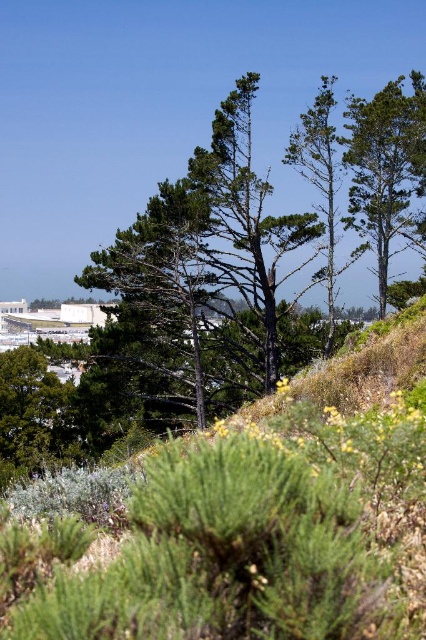
Question: Can you confirm if green matte tree at upper right is smaller than green matte tree at center?

Choices:
 (A) no
 (B) yes

Answer: (A)

Question: Among these objects, which one is nearest to the camera?

Choices:
 (A) green matte tree at center
 (B) green matte tree at upper right

Answer: (B)

Question: Is green matte tree at upper right above green matte tree at center?

Choices:
 (A) yes
 (B) no

Answer: (A)

Question: Which of the following is the farthest from the observer?

Choices:
 (A) (54, 410)
 (B) (359, 218)

Answer: (B)

Question: Which point is farther from the camera taking this photo?

Choices:
 (A) (379, 145)
 (B) (77, 445)

Answer: (B)

Question: Can you confirm if green matte tree at upper right is wider than green matte tree at center?

Choices:
 (A) no
 (B) yes

Answer: (A)